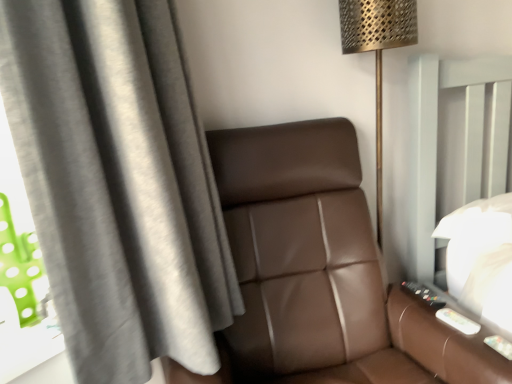
Question: Considering the positions of gray fabric curtain at left and brown leather chair at center in the image, is gray fabric curtain at left wider or thinner than brown leather chair at center?

Choices:
 (A) wide
 (B) thin

Answer: (B)

Question: Would you say gray fabric curtain at left is inside or outside brown leather chair at center?

Choices:
 (A) inside
 (B) outside

Answer: (B)

Question: Which object is positioned farthest from the metallic gold floor lamp at upper right?

Choices:
 (A) gray fabric curtain at left
 (B) brown leather chair at center

Answer: (A)

Question: Estimate the real-world distances between objects in this image. Which object is farther from the brown leather chair at center?

Choices:
 (A) gray fabric curtain at left
 (B) metallic gold floor lamp at upper right

Answer: (B)